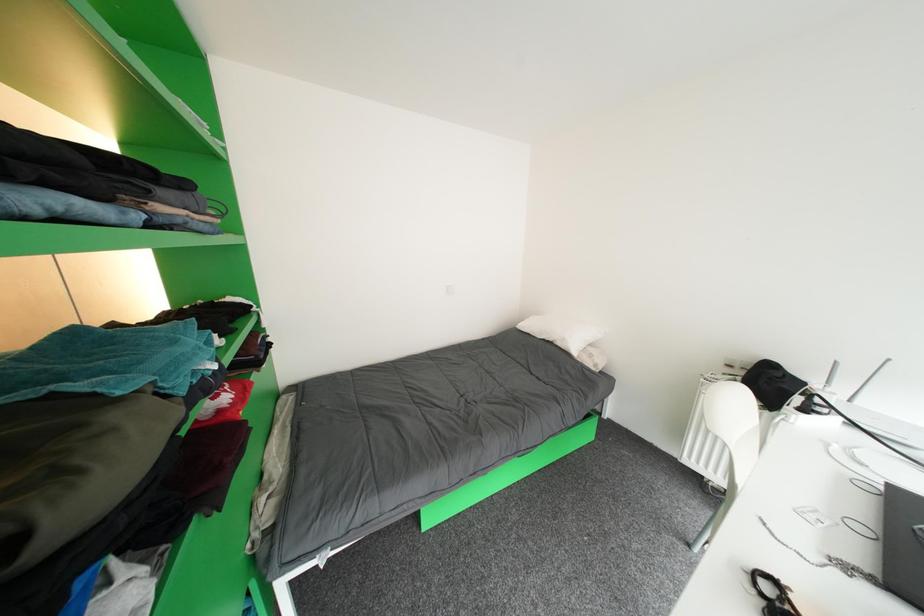
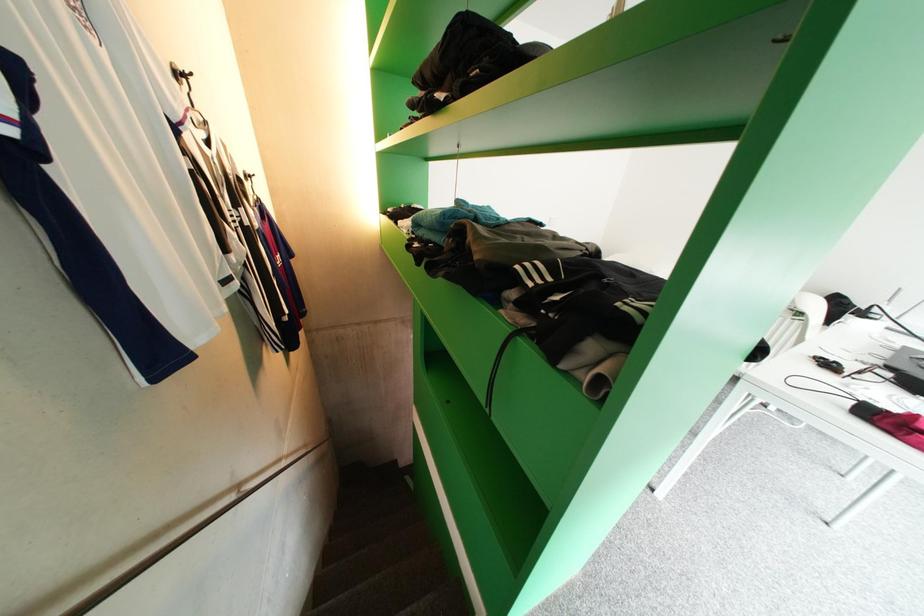
Question: The first image is from the beginning of the video and the second image is from the end. How did the camera likely rotate when shooting the video?

Choices:
 (A) Left
 (B) Right
 (C) Up
 (D) Down

Answer: (D)